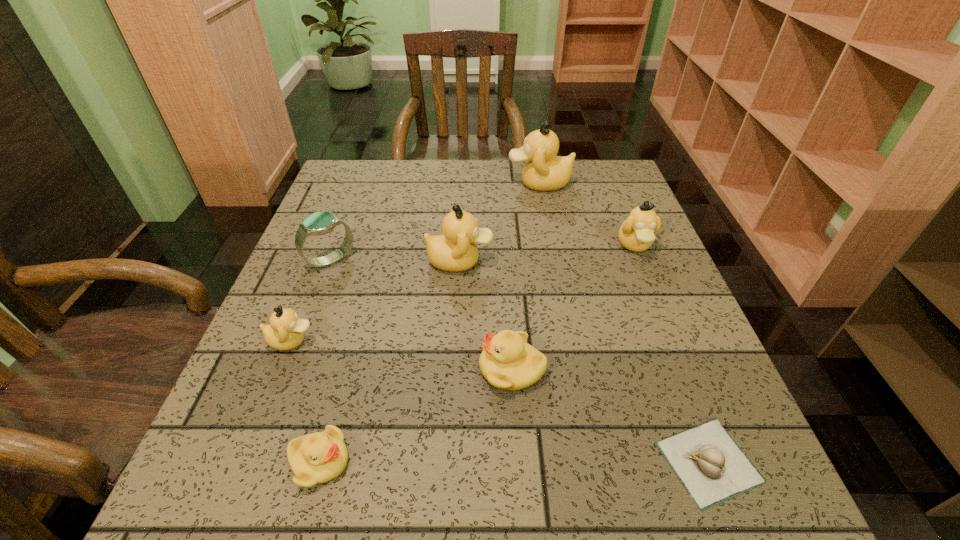
Locate an element on the screen. Image resolution: width=960 pixels, height=540 pixels. free location located 0.220m on the face of the leftmost duckling is located at coordinates (433, 341).

This screenshot has height=540, width=960. I want to click on free space located at the face of the bigger yellow duckling, so click(259, 368).

The image size is (960, 540). I want to click on vacant space situated at the face of the bigger yellow duckling, so click(x=360, y=368).

You are a GUI agent. You are given a task and a screenshot of the screen. Output one action in this format:
    pyautogui.click(x=<x>, y=<y>)
    Task: Click on the vacant region located at the face of the bigger yellow duckling
    The height and width of the screenshot is (540, 960).
    Given the screenshot: What is the action you would take?
    pyautogui.click(x=281, y=368)

Image resolution: width=960 pixels, height=540 pixels. Find the location of `vacant space located 0.360m at the face of the second duckling from left to right`. vacant space located 0.360m at the face of the second duckling from left to right is located at coordinates (589, 462).

You are a GUI agent. You are given a task and a screenshot of the screen. Output one action in this format:
    pyautogui.click(x=<x>, y=<y>)
    Task: Click on the vacant region located on the left of the garlic
    This screenshot has height=540, width=960.
    Given the screenshot: What is the action you would take?
    pyautogui.click(x=486, y=462)

Image resolution: width=960 pixels, height=540 pixels. In order to click on object that is at the far edge in this screenshot , I will do 544,171.

Locate an element on the screen. This screenshot has width=960, height=540. duckling that is at the near edge is located at coordinates [x=319, y=457].

Identify the location of garlic that is at the near edge. (711, 466).

The image size is (960, 540). I want to click on watch located at the left edge, so click(x=319, y=223).